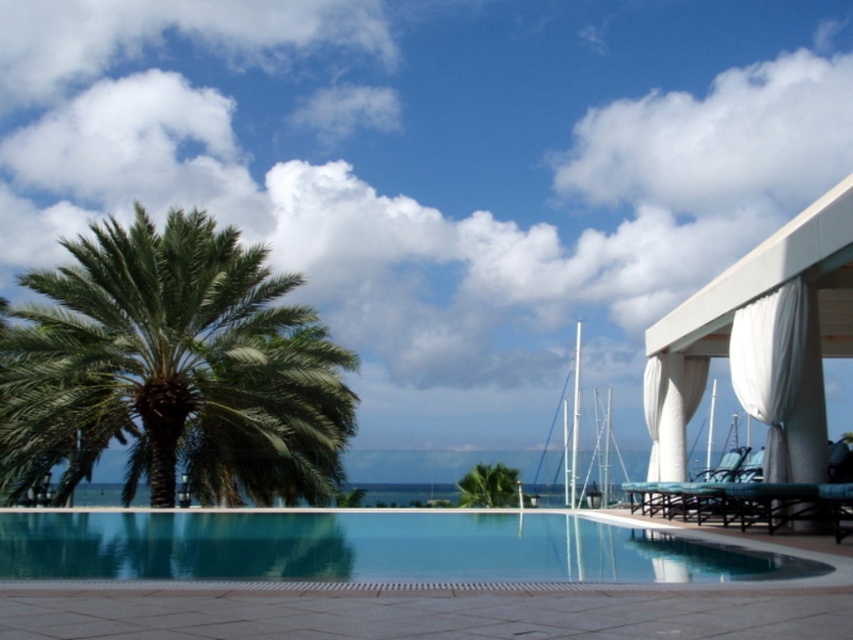
Between clear glass pool at center and white glossy masts at upper center, which one appears on the left side from the viewer's perspective?

clear glass pool at center

Who is lower down, clear glass pool at center or white glossy masts at upper center?

Positioned lower is white glossy masts at upper center.

Who is more distant from viewer, (198, 561) or (604, 484)?

Positioned behind is point (604, 484).

The width and height of the screenshot is (853, 640). In order to click on clear glass pool at center in this screenshot , I will do `click(369, 548)`.

Is green leafy palm tree at left bigger than clear glass pool at center?

Correct, green leafy palm tree at left is larger in size than clear glass pool at center.

Which of these two, green leafy palm tree at left or clear glass pool at center, stands taller?

With more height is green leafy palm tree at left.

The width and height of the screenshot is (853, 640). What do you see at coordinates (173, 365) in the screenshot?
I see `green leafy palm tree at left` at bounding box center [173, 365].

In order to click on green leafy palm tree at left in this screenshot , I will do `click(173, 365)`.

Who is more distant from viewer, (49,410) or (566,440)?

Positioned behind is point (566,440).

Based on the photo, does green leafy palm tree at left have a lesser height compared to white glossy masts at upper center?

Correct, green leafy palm tree at left is not as tall as white glossy masts at upper center.

Where is `green leafy palm tree at left`? green leafy palm tree at left is located at coordinates (173, 365).

In order to click on green leafy palm tree at left in this screenshot , I will do `click(173, 365)`.